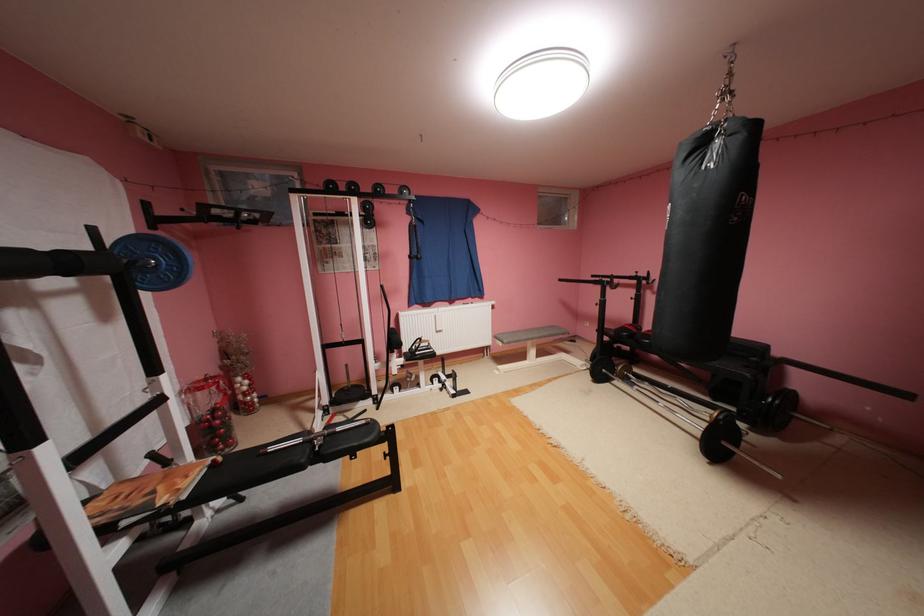
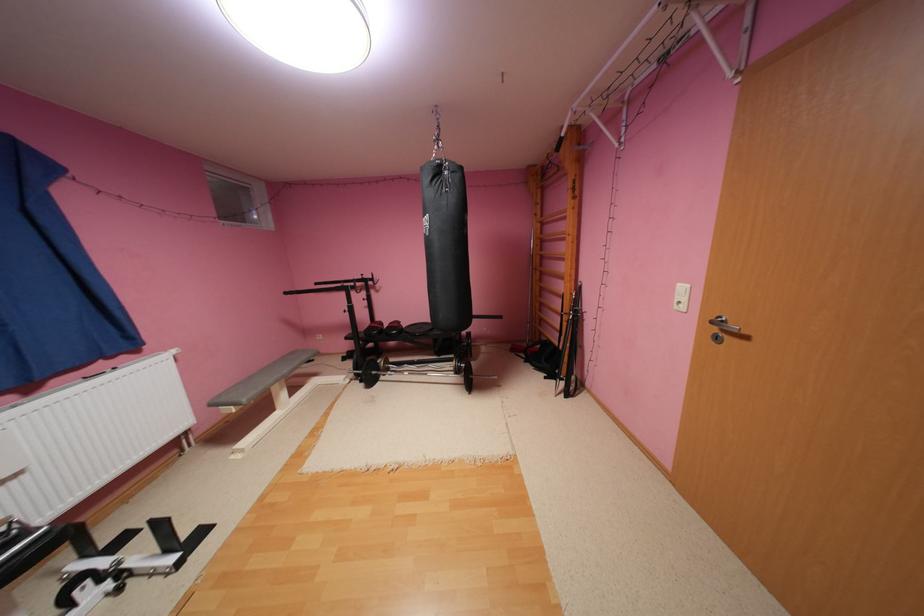
Question: The camera is either moving clockwise (left) or counter-clockwise (right) around the object. The first image is from the beginning of the video and the second image is from the end. Is the camera moving left or right when shooting the video?

Choices:
 (A) Left
 (B) Right

Answer: (A)